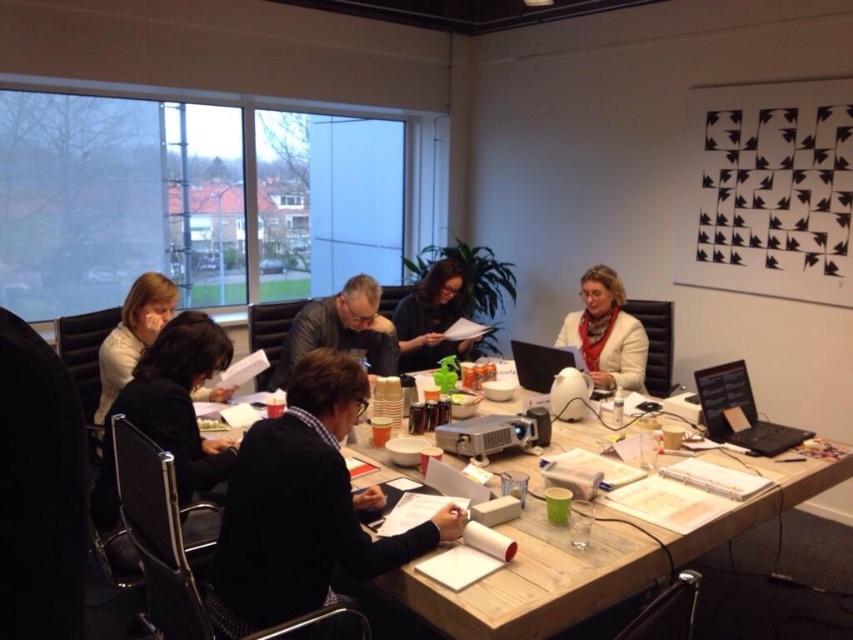
Does black plastic laptop at lower right come in front of satin black laptop at center?

Yes.

Does point (741, 403) come behind point (543, 374)?

No, (741, 403) is closer to viewer.

Between point (740, 400) and point (555, 353), which one is positioned behind?

Point (555, 353)

This screenshot has width=853, height=640. What are the coordinates of `black plastic laptop at lower right` in the screenshot? It's located at (740, 412).

Between black matte sweater at center and satin black laptop at center, which one appears on the left side from the viewer's perspective?

From the viewer's perspective, black matte sweater at center appears more on the left side.

Does black matte sweater at center lie in front of satin black laptop at center?

Yes, black matte sweater at center is in front of satin black laptop at center.

Which is in front, point (216, 593) or point (541, 371)?

Point (216, 593) is in front.

Where is `black matte sweater at center`? black matte sweater at center is located at coordinates (306, 504).

Does black matte sweater at center have a lesser height compared to black plastic laptop at lower right?

In fact, black matte sweater at center may be taller than black plastic laptop at lower right.

Is point (374, 545) closer to viewer compared to point (752, 432)?

That is True.

Where is `black matte sweater at center`? black matte sweater at center is located at coordinates (306, 504).